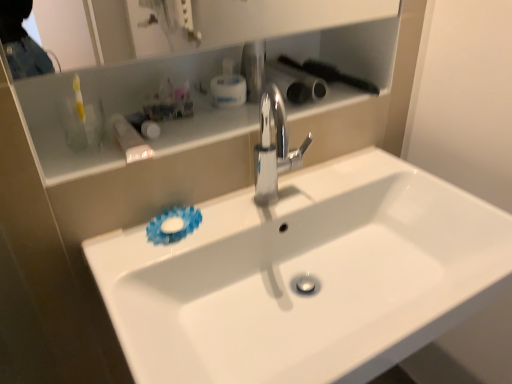
The image size is (512, 384). What are the coordinates of `vacant space situated above white glossy cabinet at upper center (from a real-world perspective)` in the screenshot? It's located at (188, 121).